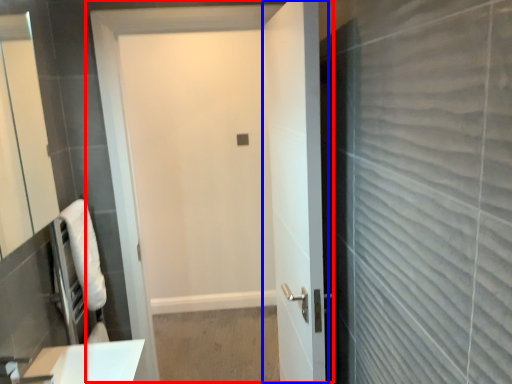
Question: Which object is closer to the camera taking this photo, door (highlighted by a red box) or door (highlighted by a blue box)?

Choices:
 (A) door
 (B) door

Answer: (B)